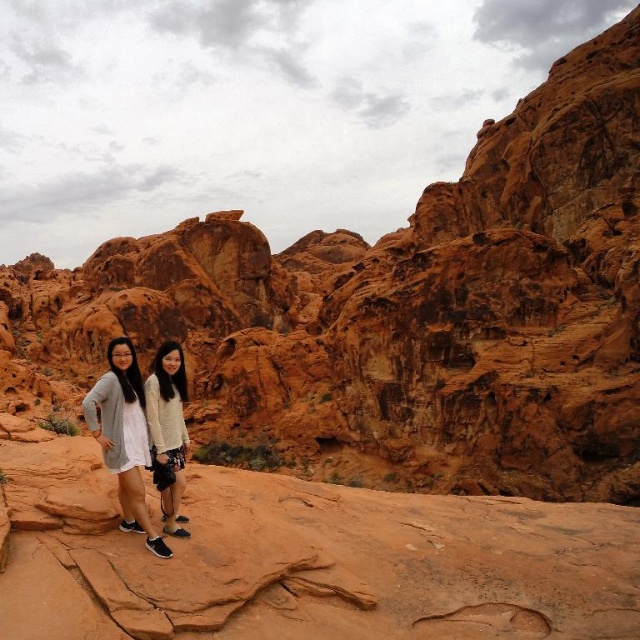
How far apart are matte gray sweater at lower left and white fuzzy sweater at center?

3.30 meters

Does matte gray sweater at lower left have a lesser width compared to white fuzzy sweater at center?

Incorrect, matte gray sweater at lower left's width is not less than white fuzzy sweater at center's.

Is point (122, 420) in front of point (168, 420)?

Yes, it is in front of point (168, 420).

Image resolution: width=640 pixels, height=640 pixels. What are the coordinates of `matte gray sweater at lower left` in the screenshot? It's located at [x=124, y=436].